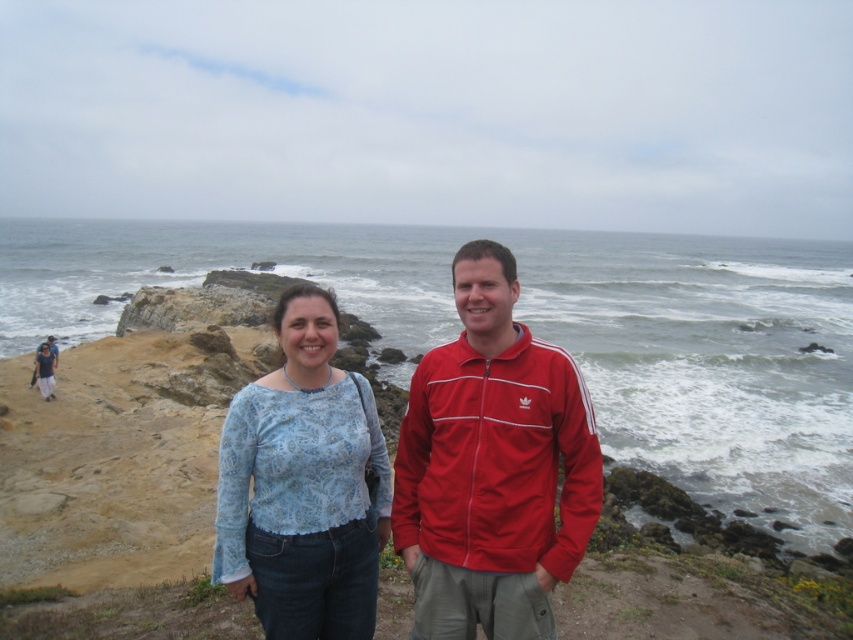
Question: Is white foamy water at center to the right of red adidas track jacket at center from the viewer's perspective?

Choices:
 (A) yes
 (B) no

Answer: (A)

Question: Does red adidas track jacket at center lie behind paisley-patterned blouse at center?

Choices:
 (A) yes
 (B) no

Answer: (B)

Question: Can you confirm if red adidas track jacket at center is positioned to the left of paisley-patterned blouse at center?

Choices:
 (A) no
 (B) yes

Answer: (A)

Question: Which point is farther to the camera?

Choices:
 (A) [x=415, y=536]
 (B) [x=277, y=480]
 (C) [x=606, y=291]

Answer: (C)

Question: Estimate the real-world distances between objects in this image. Which object is closer to the red adidas track jacket at center?

Choices:
 (A) paisley-patterned blouse at center
 (B) white foamy water at center

Answer: (A)

Question: Which point is farther from the camera taking this photo?

Choices:
 (A) (611, 364)
 (B) (374, 556)

Answer: (A)